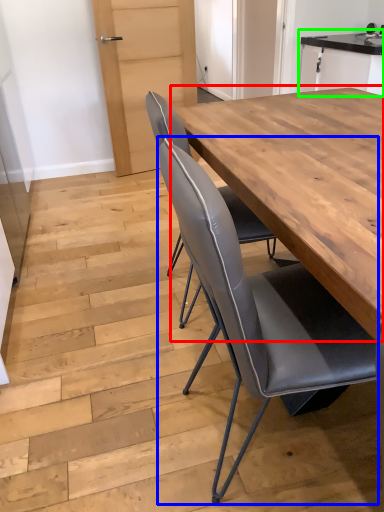
Question: Which is nearer to the table (highlighted by a red box)? chair (highlighted by a blue box) or cabinetry (highlighted by a green box).

Choices:
 (A) chair
 (B) cabinetry

Answer: (A)